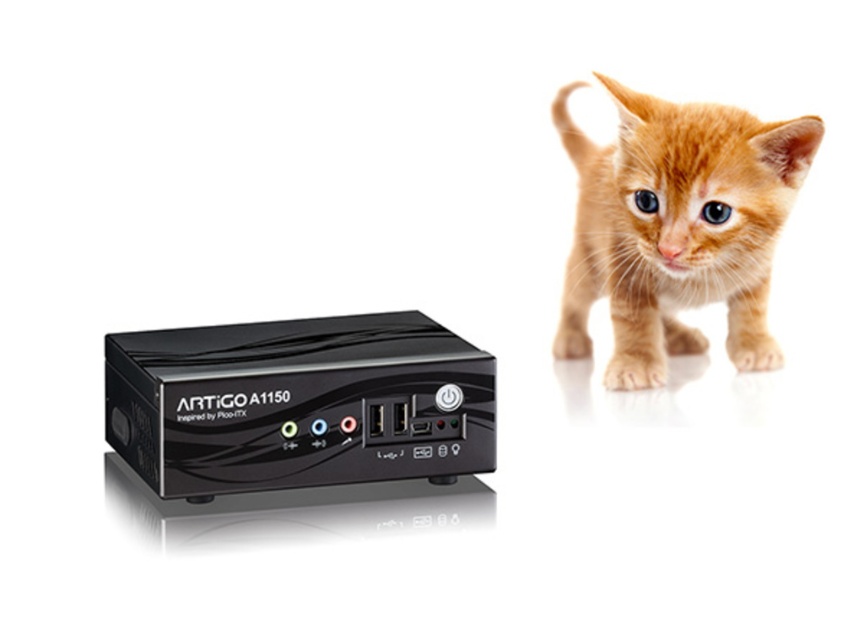
Question: Is the position of black plastic artigo a1150 at left less distant than that of orange fur kitten at upper right?

Choices:
 (A) no
 (B) yes

Answer: (B)

Question: Which object appears closest to the camera in this image?

Choices:
 (A) orange fur kitten at upper right
 (B) black plastic artigo a1150 at left

Answer: (B)

Question: Which point is farther to the camera?

Choices:
 (A) black plastic artigo a1150 at left
 (B) orange fur kitten at upper right

Answer: (B)

Question: Can you confirm if black plastic artigo a1150 at left is positioned to the right of orange fur kitten at upper right?

Choices:
 (A) yes
 (B) no

Answer: (B)

Question: Where is black plastic artigo a1150 at left located in relation to orange fur kitten at upper right in the image?

Choices:
 (A) below
 (B) above

Answer: (A)